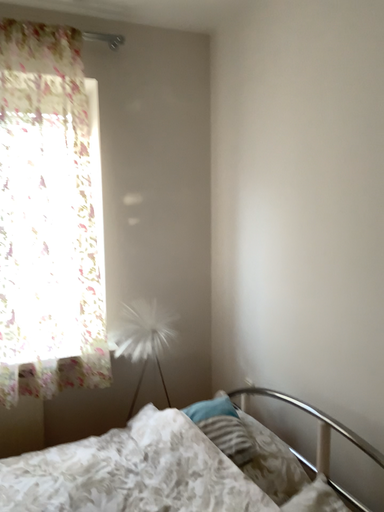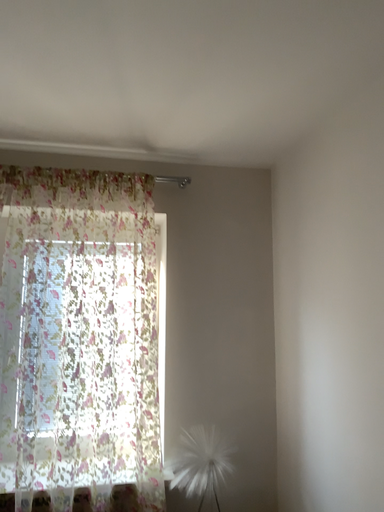
Question: How did the camera likely rotate when shooting the video?

Choices:
 (A) rotated upward
 (B) rotated downward

Answer: (A)